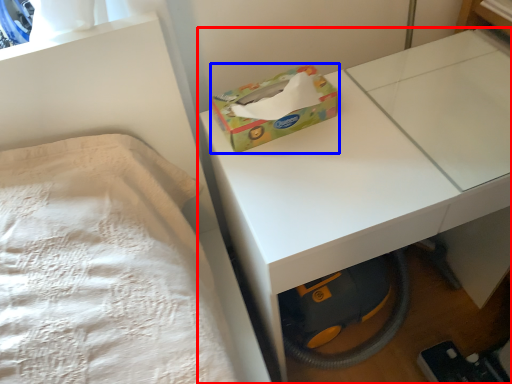
Question: Which object appears closest to the camera in this image, table (highlighted by a red box) or box (highlighted by a blue box)?

Choices:
 (A) table
 (B) box

Answer: (A)